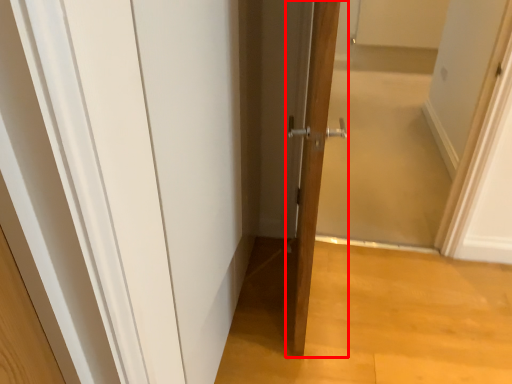
Question: Observing the image, what is the correct spatial positioning of door (annotated by the red box) in reference to screen door?

Choices:
 (A) left
 (B) right

Answer: (A)